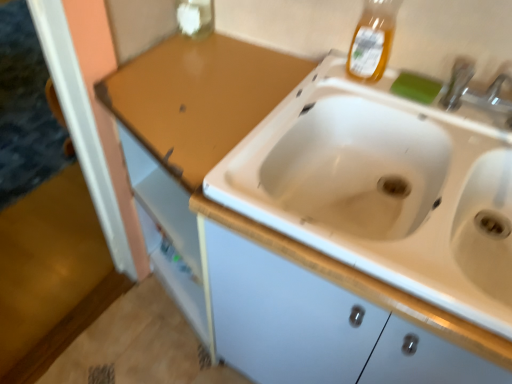
The width and height of the screenshot is (512, 384). What do you see at coordinates (416, 87) in the screenshot?
I see `green sponge at upper right` at bounding box center [416, 87].

Image resolution: width=512 pixels, height=384 pixels. Describe the element at coordinates (195, 17) in the screenshot. I see `transparent glass bottle at upper center, the 2th bottle from the right` at that location.

What are the coordinates of `transparent glass bottle at upper center, the 2th bottle from the right` in the screenshot? It's located at (195, 17).

In order to face translucent amber liquid at upper right, the first bottle when ordered from right to left, should I rotate leftwards or rightwards?

To align with it, rotate right about 15.938°.

You are a GUI agent. You are given a task and a screenshot of the screen. Output one action in this format:
    pyautogui.click(x=<x>, y=<y>)
    Task: Click on the green sponge at upper right
    This screenshot has height=384, width=512.
    Given the screenshot: What is the action you would take?
    pyautogui.click(x=416, y=87)

Is transparent glass bottle at upper center, the 2th bottle in the front-to-back sequence, positioned beyond the bounds of translucent amber liquid at upper right, which is counted as the second bottle, starting from the left?

Yes.

From the image's perspective, between transparent glass bottle at upper center, the 2th bottle from the right, and translucent amber liquid at upper right, the first bottle when ordered from right to left, which one is located above?

From the image's view, transparent glass bottle at upper center, the 2th bottle from the right, is above.

Does point (201, 26) lie behind point (360, 26)?

Yes.

From the image's perspective, is transparent glass bottle at upper center, the 1th bottle from the back, positioned above or below green sponge at upper right?

Based on their image positions, transparent glass bottle at upper center, the 1th bottle from the back, is located above green sponge at upper right.

Is transparent glass bottle at upper center, which is the first bottle in left-to-right order, inside the boundaries of green sponge at upper right, or outside?

transparent glass bottle at upper center, which is the first bottle in left-to-right order, lies outside green sponge at upper right.

Where is `bottle behind the green sponge at upper right`? The height and width of the screenshot is (384, 512). bottle behind the green sponge at upper right is located at coordinates (195, 17).

Measure the distance between transparent glass bottle at upper center, which is the first bottle in left-to-right order, and green sponge at upper right.

transparent glass bottle at upper center, which is the first bottle in left-to-right order, and green sponge at upper right are 23.13 inches apart from each other.

Is green sponge at upper right far away from translucent amber liquid at upper right, the first bottle from the front?

Actually, green sponge at upper right and translucent amber liquid at upper right, the first bottle from the front, are a little close together.

Does point (408, 90) appear closer or farther from the camera than point (365, 24)?

Clearly, point (408, 90) is more distant from the camera than point (365, 24).

From a real-world perspective, who is located higher, green sponge at upper right or translucent amber liquid at upper right, acting as the 2th bottle starting from the back?

translucent amber liquid at upper right, acting as the 2th bottle starting from the back.

Is green sponge at upper right aimed at translucent amber liquid at upper right, acting as the 2th bottle starting from the back?

No, green sponge at upper right does not turn towards translucent amber liquid at upper right, acting as the 2th bottle starting from the back.

Considering the relative positions of green sponge at upper right and transparent glass bottle at upper center, the 2th bottle in the front-to-back sequence, in the image provided, is green sponge at upper right to the right of transparent glass bottle at upper center, the 2th bottle in the front-to-back sequence, from the viewer's perspective?

Indeed, green sponge at upper right is positioned on the right side of transparent glass bottle at upper center, the 2th bottle in the front-to-back sequence.

Would you say green sponge at upper right contains transparent glass bottle at upper center, the 1th bottle from the back?

Definitely not — transparent glass bottle at upper center, the 1th bottle from the back, is not inside green sponge at upper right.

Is point (413, 95) more distant than point (203, 16)?

No.

Which object is more forward, green sponge at upper right or transparent glass bottle at upper center, the 1th bottle from the back?

green sponge at upper right is closer to the camera.

Can you confirm if translucent amber liquid at upper right, acting as the 2th bottle starting from the back, is positioned to the left of green sponge at upper right?

Indeed, translucent amber liquid at upper right, acting as the 2th bottle starting from the back, is positioned on the left side of green sponge at upper right.

Consider the image. Is translucent amber liquid at upper right, the first bottle from the front, positioned with its back to green sponge at upper right?

translucent amber liquid at upper right, the first bottle from the front, is not turned away from green sponge at upper right.

How different are the orientations of translucent amber liquid at upper right, the first bottle when ordered from right to left, and green sponge at upper right in degrees?

They differ by 4.25 degrees in their facing directions.

Would you say translucent amber liquid at upper right, the first bottle from the front, contains green sponge at upper right?

No, green sponge at upper right is not inside translucent amber liquid at upper right, the first bottle from the front.

At what (x,y) coordinates should I click in order to perform the action: click on bottle above the translucent amber liquid at upper right, which is counted as the second bottle, starting from the left (from the image's perspective). Please return your answer as a coordinate pair (x, y). Image resolution: width=512 pixels, height=384 pixels. Looking at the image, I should click on (195, 17).

Is point (355, 65) positioned behind point (178, 3)?

No, (355, 65) is closer to viewer.

Measure the distance between translucent amber liquid at upper right, which is counted as the second bottle, starting from the left, and transparent glass bottle at upper center, the 2th bottle from the right.

translucent amber liquid at upper right, which is counted as the second bottle, starting from the left, and transparent glass bottle at upper center, the 2th bottle from the right, are 18.71 inches apart.

Is translucent amber liquid at upper right, acting as the 2th bottle starting from the back, facing towards transparent glass bottle at upper center, the 1th bottle from the back?

No.

Identify the location of bottle below the transparent glass bottle at upper center, the 1th bottle from the back (from the image's perspective). This screenshot has width=512, height=384. (372, 40).

From the image's perspective, count 2nd bottles upward from the green sponge at upper right and point to it. Please provide its 2D coordinates.

[(195, 17)]

When comparing their distances from transparent glass bottle at upper center, the 2th bottle from the right, does translucent amber liquid at upper right, the first bottle when ordered from right to left, or green sponge at upper right seem closer?

Based on the image, translucent amber liquid at upper right, the first bottle when ordered from right to left, appears to be nearer to transparent glass bottle at upper center, the 2th bottle from the right.

Looking at the image, which one is located closer to translucent amber liquid at upper right, which is counted as the second bottle, starting from the left, green sponge at upper right or transparent glass bottle at upper center, the 2th bottle from the right?

Based on the image, green sponge at upper right appears to be nearer to translucent amber liquid at upper right, which is counted as the second bottle, starting from the left.

Considering their positions, is translucent amber liquid at upper right, the first bottle from the front, positioned further to green sponge at upper right than transparent glass bottle at upper center, the 2th bottle from the right?

transparent glass bottle at upper center, the 2th bottle from the right, lies further to green sponge at upper right than the other object.

Which object lies nearer to the anchor point transparent glass bottle at upper center, the 2th bottle from the right, green sponge at upper right or translucent amber liquid at upper right, the first bottle when ordered from right to left?

translucent amber liquid at upper right, the first bottle when ordered from right to left, is positioned closer to the anchor transparent glass bottle at upper center, the 2th bottle from the right.

Considering their positions, is transparent glass bottle at upper center, the 1th bottle from the back, positioned closer to green sponge at upper right than translucent amber liquid at upper right, which is counted as the second bottle, starting from the left?

Among the two, translucent amber liquid at upper right, which is counted as the second bottle, starting from the left, is located nearer to green sponge at upper right.

From the picture: From the image, which object appears to be farther from translucent amber liquid at upper right, the first bottle from the front, transparent glass bottle at upper center, the 1th bottle from the back, or green sponge at upper right?

transparent glass bottle at upper center, the 1th bottle from the back.

This screenshot has width=512, height=384. Identify the location of bottle between transparent glass bottle at upper center, the 2th bottle from the right, and green sponge at upper right from left to right. (372, 40).